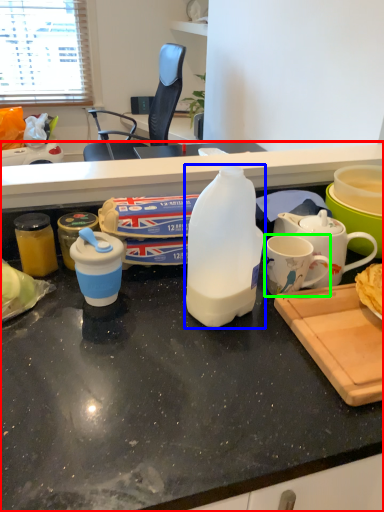
Question: Considering the real-world distances, which object is farthest from desk (highlighted by a red box)? bottle (highlighted by a blue box) or coffee cup (highlighted by a green box)?

Choices:
 (A) bottle
 (B) coffee cup

Answer: (B)